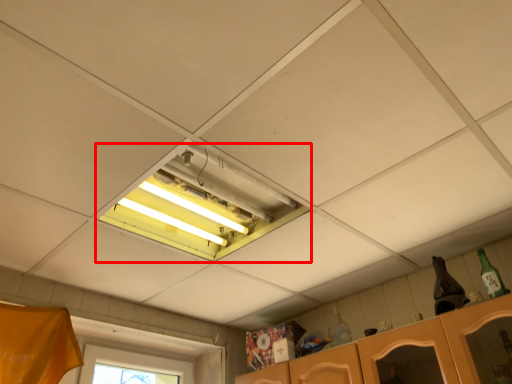
Question: From the image's perspective, considering the relative positions of window (annotated by the red box) and bottle in the image provided, where is window (annotated by the red box) located with respect to the staircase?

Choices:
 (A) above
 (B) below

Answer: (A)